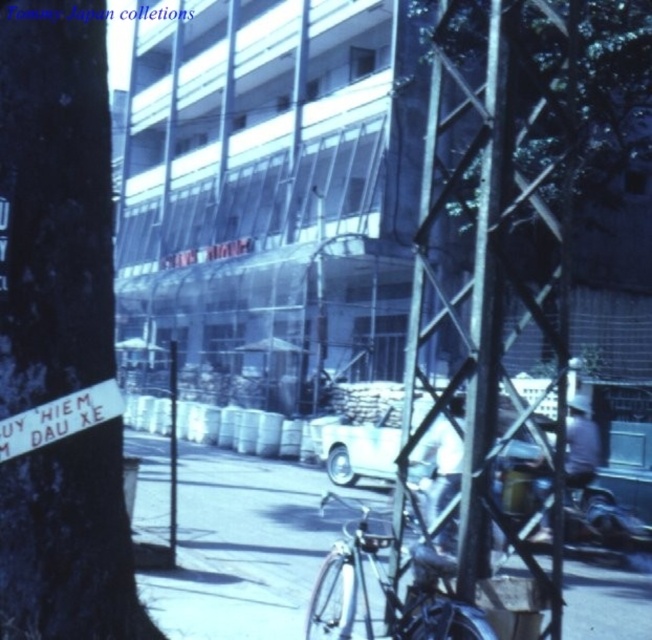
You are a delivery person trying to park your white matte car at center on the smooth asphalt pavement at center. Can you safely park your car on the pavement?

The smooth asphalt pavement at center is located below the white matte car at center, so yes, the car can be parked on the pavement since it is positioned directly above the pavement.

You are a delivery person who needs to park your white matte car at center as close as possible to the smooth asphalt pavement at center. What is the minimum distance you can achieve between them?

The smooth asphalt pavement at center is 5.88 feet from white matte car at center, so the minimum distance you can achieve between them is 5.88 feet.

You are a photographer trying to capture a clear shot of the white matte car at center without the green bark tree at left blocking the view. Based on their positions, can you move to your right or left to avoid the tree?

Since the green bark tree at left is to the left of the white matte car at center, moving to your right would position the tree out of the frame, allowing you to capture the car without obstruction.